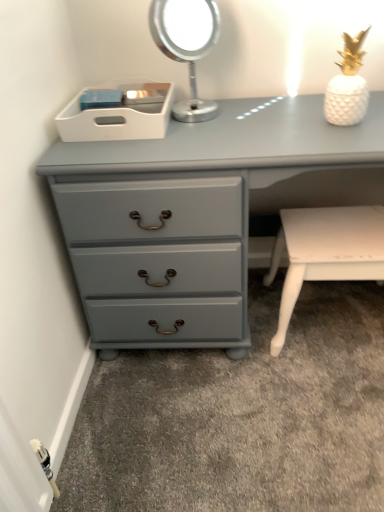
Locate an element on the screen. Image resolution: width=384 pixels, height=512 pixels. metallic silver mirror at upper center is located at coordinates (187, 46).

This screenshot has width=384, height=512. Identify the location of white glossy table at lower right. (325, 252).

Considering the relative sizes of white glossy table at lower right and matte gray chest of drawers at lower left in the image provided, is white glossy table at lower right bigger than matte gray chest of drawers at lower left?

No, white glossy table at lower right is not bigger than matte gray chest of drawers at lower left.

In the scene shown: From a real-world perspective, relative to matte gray chest of drawers at lower left, is white glossy table at lower right vertically above or below?

In terms of real-world spatial position, white glossy table at lower right is below matte gray chest of drawers at lower left.

Which object is positioned more to the right, white glossy table at lower right or matte gray chest of drawers at lower left?

white glossy table at lower right.

There is a white glossy table at lower right. In order to click on the chest of drawers above it (from a real-world perspective) in this screenshot , I will do `click(199, 213)`.

From a real-world perspective, does white glossy table at lower right stand above white plastic tray at upper center?

No.

Consider the image. Considering the sizes of objects white glossy table at lower right and white plastic tray at upper center in the image provided, who is bigger, white glossy table at lower right or white plastic tray at upper center?

With larger size is white glossy table at lower right.

Is white glossy table at lower right positioned far away from white plastic tray at upper center?

Actually, white glossy table at lower right and white plastic tray at upper center are a little close together.

Which is closer, (153, 8) or (188, 162)?

The point (188, 162) is in front.

Does metallic silver mirror at upper center contain matte gray chest of drawers at lower left?

No.

Where is `chest of drawers located on the right of metallic silver mirror at upper center`? chest of drawers located on the right of metallic silver mirror at upper center is located at coordinates (199, 213).

Does metallic silver mirror at upper center have a larger size compared to matte gray chest of drawers at lower left?

No.

Looking at this image, is metallic silver mirror at upper center facing towards white plastic tray at upper center?

No, metallic silver mirror at upper center is not oriented towards white plastic tray at upper center.

Is metallic silver mirror at upper center far away from white plastic tray at upper center?

No.

Consider the image. Considering the relative sizes of metallic silver mirror at upper center and white plastic tray at upper center in the image provided, is metallic silver mirror at upper center taller than white plastic tray at upper center?

Result: Correct, metallic silver mirror at upper center is much taller as white plastic tray at upper center.

Considering the sizes of objects metallic silver mirror at upper center and white plastic tray at upper center in the image provided, who is bigger, metallic silver mirror at upper center or white plastic tray at upper center?

With larger size is metallic silver mirror at upper center.

How much distance is there between white plastic tray at upper center and matte gray chest of drawers at lower left?

white plastic tray at upper center is 10.00 inches from matte gray chest of drawers at lower left.

Is white plastic tray at upper center not near matte gray chest of drawers at lower left?

That's not correct — white plastic tray at upper center is a little close to matte gray chest of drawers at lower left.

In the scene shown: How many degrees apart are the facing directions of white plastic tray at upper center and matte gray chest of drawers at lower left?

0.331 degrees separate the facing orientations of white plastic tray at upper center and matte gray chest of drawers at lower left.

In the scene shown: Which object is more forward, white plastic tray at upper center or matte gray chest of drawers at lower left?

matte gray chest of drawers at lower left.

Consider the image. Measure the distance from white plastic tray at upper center to white glossy table at lower right.

white plastic tray at upper center is 23.64 inches from white glossy table at lower right.

Would you say white plastic tray at upper center contains white glossy table at lower right?

Actually, white glossy table at lower right is outside white plastic tray at upper center.

Does white plastic tray at upper center touch white glossy table at lower right?

No, white plastic tray at upper center is not making contact with white glossy table at lower right.

Who is shorter, white plastic tray at upper center or white glossy table at lower right?

white plastic tray at upper center is shorter.

Does white plastic tray at upper center have a larger size compared to metallic silver mirror at upper center?

No, white plastic tray at upper center is not bigger than metallic silver mirror at upper center.

In terms of width, does white plastic tray at upper center look wider or thinner when compared to metallic silver mirror at upper center?

Clearly, white plastic tray at upper center has more width compared to metallic silver mirror at upper center.

The image size is (384, 512). Identify the location of bedside lamp to the right of white plastic tray at upper center. (187, 46).

Is white plastic tray at upper center turned away from metallic silver mirror at upper center?

No, white plastic tray at upper center is not facing away from metallic silver mirror at upper center.

You are a GUI agent. You are given a task and a screenshot of the screen. Output one action in this format:
    pyautogui.click(x=<x>, y=<y>)
    Task: Click on the chest of drawers in front of the white glossy table at lower right
    The height and width of the screenshot is (512, 384).
    Given the screenshot: What is the action you would take?
    pyautogui.click(x=199, y=213)

The image size is (384, 512). What are the coordinates of `table behind the white plastic tray at upper center` in the screenshot? It's located at (325, 252).

Considering their positions, is white plastic tray at upper center positioned further to metallic silver mirror at upper center than matte gray chest of drawers at lower left?

Based on the image, matte gray chest of drawers at lower left appears to be further to metallic silver mirror at upper center.

Looking at the image, which one is located further to matte gray chest of drawers at lower left, white plastic tray at upper center or white glossy table at lower right?

white glossy table at lower right is positioned further to the anchor matte gray chest of drawers at lower left.

Estimate the real-world distances between objects in this image. Which object is further from metallic silver mirror at upper center, matte gray chest of drawers at lower left or white plastic tray at upper center?

matte gray chest of drawers at lower left is further to metallic silver mirror at upper center.

Based on their spatial positions, is metallic silver mirror at upper center or white glossy table at lower right further from white plastic tray at upper center?

white glossy table at lower right lies further to white plastic tray at upper center than the other object.

Considering their positions, is white glossy table at lower right positioned further to matte gray chest of drawers at lower left than metallic silver mirror at upper center?

metallic silver mirror at upper center is further to matte gray chest of drawers at lower left.

Based on their spatial positions, is white glossy table at lower right or matte gray chest of drawers at lower left further from metallic silver mirror at upper center?

white glossy table at lower right.

From the image, which object appears to be nearer to white glossy table at lower right, metallic silver mirror at upper center or matte gray chest of drawers at lower left?

matte gray chest of drawers at lower left is closer to white glossy table at lower right.

When comparing their distances from white plastic tray at upper center, does matte gray chest of drawers at lower left or white glossy table at lower right seem further?

white glossy table at lower right is further to white plastic tray at upper center.

At what (x,y) coordinates should I click in order to perform the action: click on chest of drawers between white plastic tray at upper center and white glossy table at lower right from left to right. Please return your answer as a coordinate pair (x, y). The width and height of the screenshot is (384, 512). Looking at the image, I should click on (199, 213).

I want to click on storage box between metallic silver mirror at upper center and matte gray chest of drawers at lower left from top to bottom, so click(x=117, y=113).

Locate an element on the screen. This screenshot has height=512, width=384. chest of drawers between metallic silver mirror at upper center and white glossy table at lower right from top to bottom is located at coordinates (199, 213).

Image resolution: width=384 pixels, height=512 pixels. I want to click on bedside lamp between white plastic tray at upper center and white glossy table at lower right in the horizontal direction, so click(187, 46).